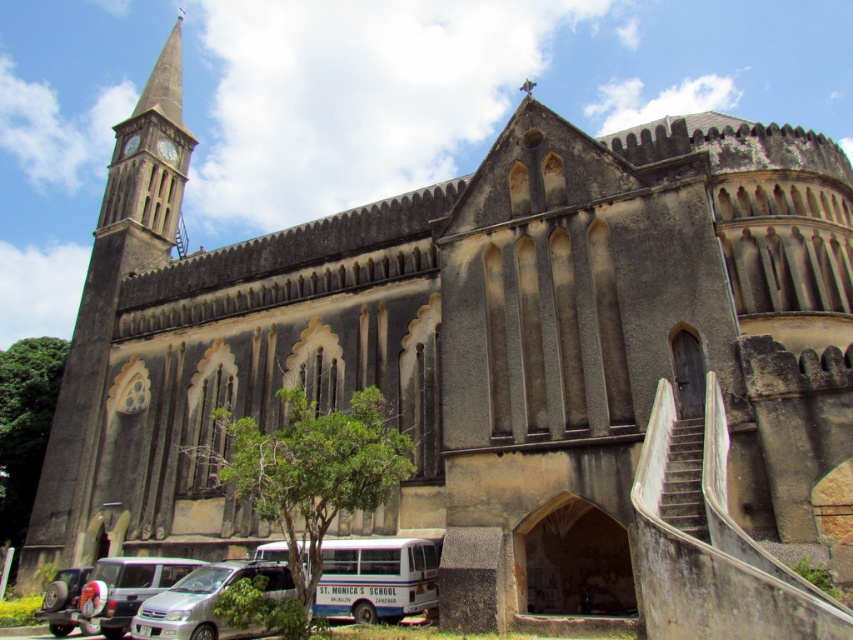
Question: Observing the image, what is the correct spatial positioning of white matte bus at lower center in reference to silver metallic van at lower left?

Choices:
 (A) above
 (B) below

Answer: (A)

Question: Which of the following is the farthest from the observer?

Choices:
 (A) (192, 628)
 (B) (339, 605)
 (C) (91, 632)

Answer: (C)

Question: Does white matte bus at lower center appear under silver metallic car at lower left?

Choices:
 (A) no
 (B) yes

Answer: (A)

Question: Can you confirm if white matte bus at lower center is smaller than silver metallic car at lower left?

Choices:
 (A) no
 (B) yes

Answer: (B)

Question: Which point is farther from the camera taking this photo?

Choices:
 (A) (171, 616)
 (B) (115, 627)
 (C) (398, 560)

Answer: (C)

Question: Which point appears closest to the camera in this image?

Choices:
 (A) (82, 618)
 (B) (154, 621)
 (C) (343, 596)

Answer: (B)